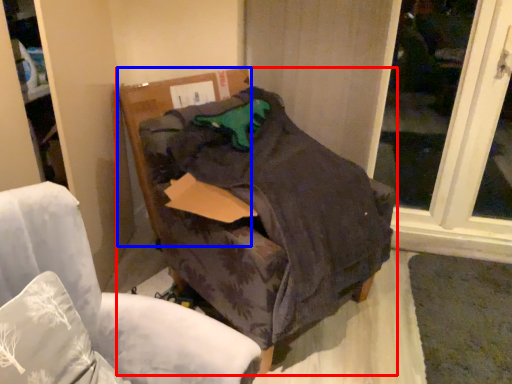
Question: Among these objects, which one is farthest to the camera, furniture (highlighted by a red box) or cardboard box (highlighted by a blue box)?

Choices:
 (A) furniture
 (B) cardboard box

Answer: (B)